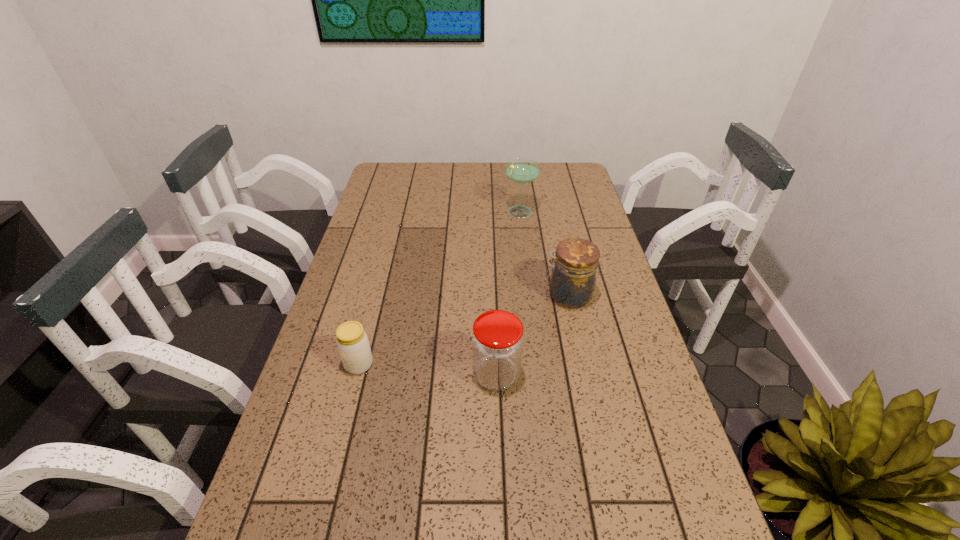
Identify the location of unoccupied position between the rightmost jar and the martini. The image size is (960, 540). (543, 253).

The height and width of the screenshot is (540, 960). Find the location of `free space between the second jar from right to left and the rightmost jar`. free space between the second jar from right to left and the rightmost jar is located at coordinates (532, 335).

Where is `free space between the second farthest object and the second jar from right to left`? The width and height of the screenshot is (960, 540). free space between the second farthest object and the second jar from right to left is located at coordinates (532, 335).

At what (x,y) coordinates should I click in order to perform the action: click on empty space that is in between the second jar from right to left and the martini. Please return your answer as a coordinate pair (x, y). The width and height of the screenshot is (960, 540). Looking at the image, I should click on (508, 293).

The image size is (960, 540). In order to click on free space that is in between the third nearest object and the farthest object in this screenshot , I will do `click(543, 253)`.

Where is `free point between the farthest object and the second jar from right to left`? free point between the farthest object and the second jar from right to left is located at coordinates (508, 293).

Locate an element on the screen. Image resolution: width=960 pixels, height=540 pixels. vacant area between the second jar from right to left and the leftmost object is located at coordinates (427, 369).

Image resolution: width=960 pixels, height=540 pixels. I want to click on free space between the rightmost jar and the second jar from right to left, so click(x=532, y=335).

The width and height of the screenshot is (960, 540). I want to click on object that is the third closest to the shortest jar, so click(x=521, y=170).

What are the coordinates of `object that is the second closest to the second jar from right to left` in the screenshot? It's located at (352, 341).